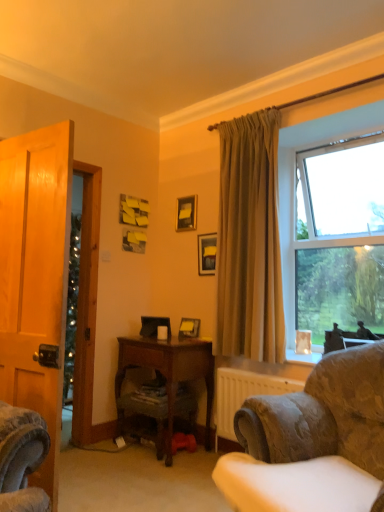
Question: Is beige fabric curtain at upper right bigger than wooden desk at center?

Choices:
 (A) no
 (B) yes

Answer: (A)

Question: Is the position of beige fabric curtain at upper right more distant than that of wooden desk at center?

Choices:
 (A) yes
 (B) no

Answer: (B)

Question: Does beige fabric curtain at upper right have a greater width compared to wooden desk at center?

Choices:
 (A) no
 (B) yes

Answer: (A)

Question: Is beige fabric curtain at upper right closer to camera compared to wooden desk at center?

Choices:
 (A) no
 (B) yes

Answer: (B)

Question: Does beige fabric curtain at upper right appear on the left side of wooden desk at center?

Choices:
 (A) no
 (B) yes

Answer: (A)

Question: Is beige fabric curtain at upper right not near wooden desk at center?

Choices:
 (A) no
 (B) yes

Answer: (A)

Question: Considering the relative sizes of matte black picture frame at upper center, positioned as the 2th picture frame in top-to-bottom order, and beige fabric curtain at upper right in the image provided, is matte black picture frame at upper center, positioned as the 2th picture frame in top-to-bottom order, wider than beige fabric curtain at upper right?

Choices:
 (A) yes
 (B) no

Answer: (B)

Question: Can you confirm if matte black picture frame at upper center, positioned as the 2th picture frame in top-to-bottom order, is bigger than beige fabric curtain at upper right?

Choices:
 (A) no
 (B) yes

Answer: (A)

Question: Is the position of matte black picture frame at upper center, positioned as the 2th picture frame in top-to-bottom order, more distant than that of beige fabric curtain at upper right?

Choices:
 (A) no
 (B) yes

Answer: (B)

Question: From a real-world perspective, is matte black picture frame at upper center, which ranks as the second picture frame in bottom-to-top order, below beige fabric curtain at upper right?

Choices:
 (A) yes
 (B) no

Answer: (A)

Question: Is the position of matte black picture frame at upper center, positioned as the 2th picture frame in top-to-bottom order, less distant than that of beige fabric curtain at upper right?

Choices:
 (A) no
 (B) yes

Answer: (A)

Question: Considering the relative sizes of matte black picture frame at upper center, positioned as the 2th picture frame in top-to-bottom order, and beige fabric curtain at upper right in the image provided, is matte black picture frame at upper center, positioned as the 2th picture frame in top-to-bottom order, smaller than beige fabric curtain at upper right?

Choices:
 (A) yes
 (B) no

Answer: (A)

Question: Is matte black picture frame at upper center, positioned as the 2th picture frame in top-to-bottom order, positioned in front of matte black picture frame at upper center, which appears as the 3th picture frame when ordered from the bottom?

Choices:
 (A) yes
 (B) no

Answer: (A)